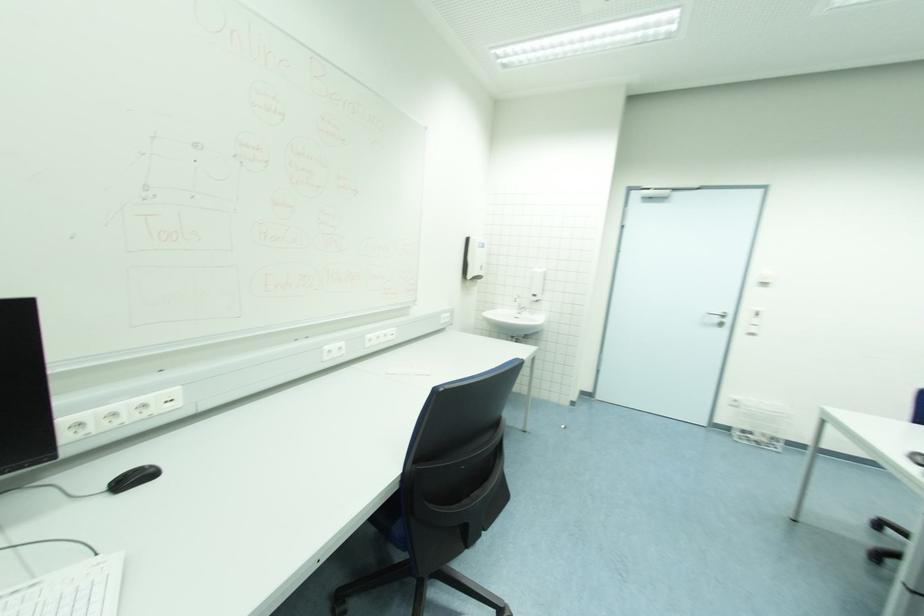
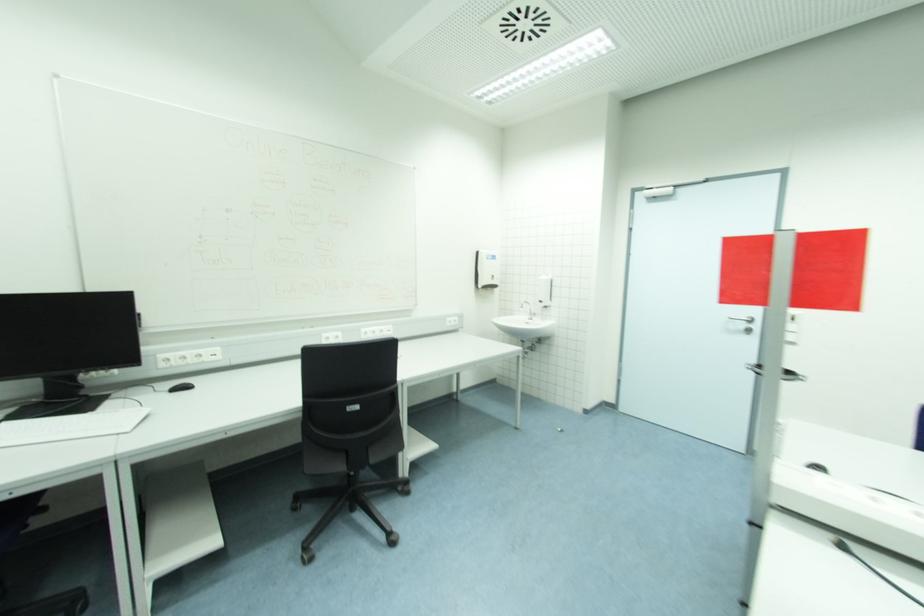
In the second image, find the point that corresponds to point 537,297 in the first image.

(543, 302)